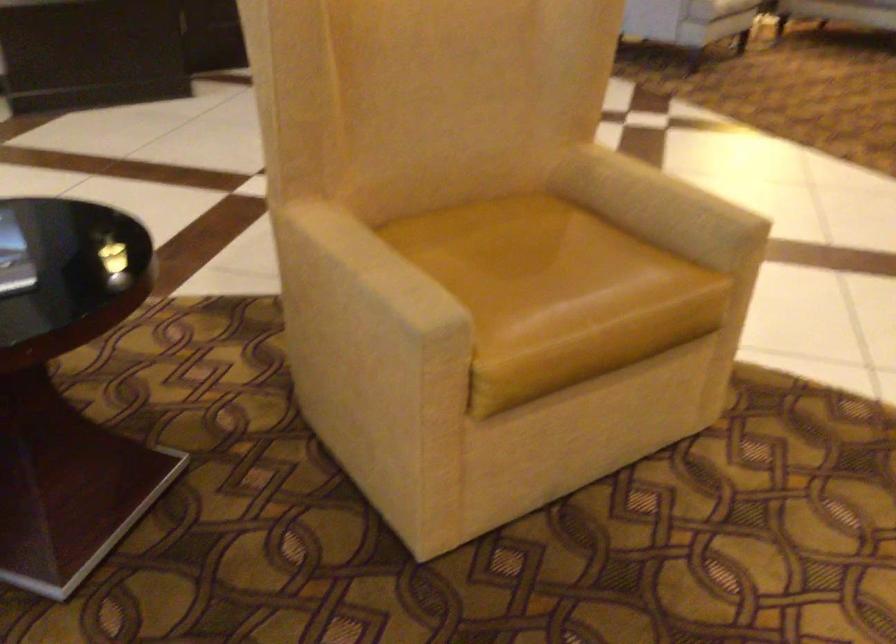
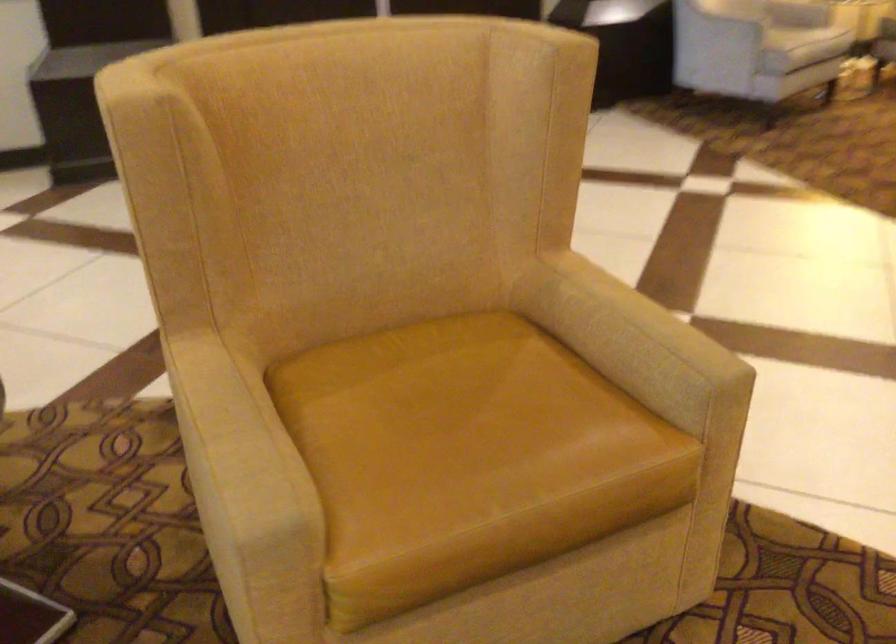
Where in the second image is the point corresponding to pixel 657 190 from the first image?

(624, 322)